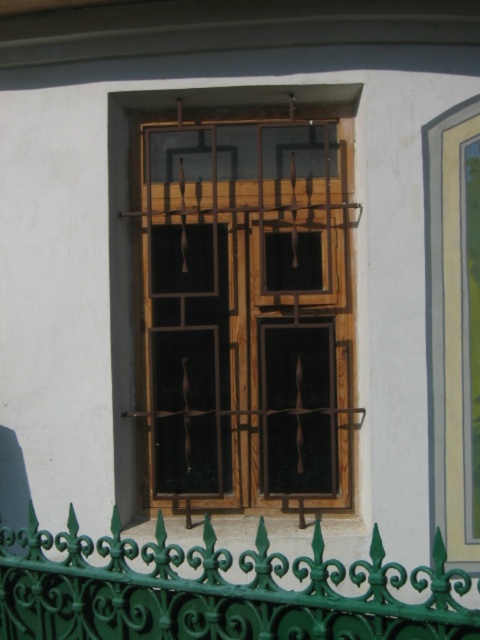
Does wooden window at center have a larger size compared to green wrought iron fence at lower center?

Yes, wooden window at center is bigger than green wrought iron fence at lower center.

Does wooden window at center lie in front of green wrought iron fence at lower center?

No, it is behind green wrought iron fence at lower center.

What do you see at coordinates (247, 308) in the screenshot?
I see `wooden window at center` at bounding box center [247, 308].

This screenshot has height=640, width=480. In order to click on wooden window at center in this screenshot , I will do `click(247, 308)`.